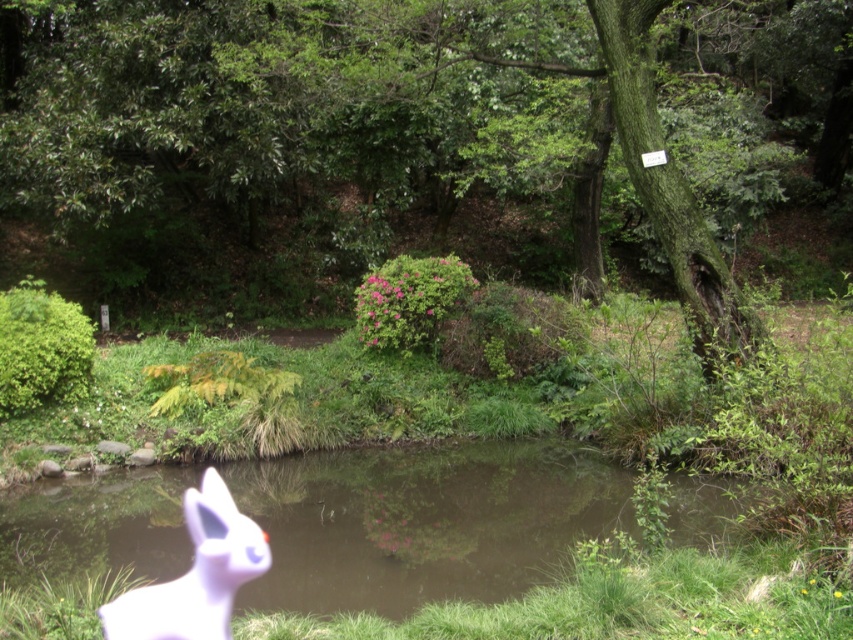
You are standing at the bottom left corner of the scene. You want to walk towards the transparent water at pond center. Which direction should you move? Please provide your answer in terms of cardinal directions like north, south, east, west. Assume the scene is oriented with the bottom of the image as south.

You should move northeast towards the transparent water at pond center because it is located at point (424,522), which is northeast from the bottom left corner.

You are a photographer trying to capture the reflection of the purple matte rabbit at lower left in the transparent water at pond center. Can you expect to see the reflection clearly?

The transparent water at pond center has a lesser height compared to purple matte rabbit at lower left, so the reflection of the purple matte rabbit at lower left may not be fully visible or clear in the water since the water level is lower than the rabbit.

You are a photographer trying to capture the purple matte rabbit at lower left and the transparent water at pond center in a single shot. However, the rabbit is partially obscured by the water. Can you adjust your position to see both objects clearly without moving them?

The purple matte rabbit at lower left is behind the transparent water at pond center, so adjusting your position slightly might allow you to see both clearly by finding an angle where the rabbit is not directly behind the water.